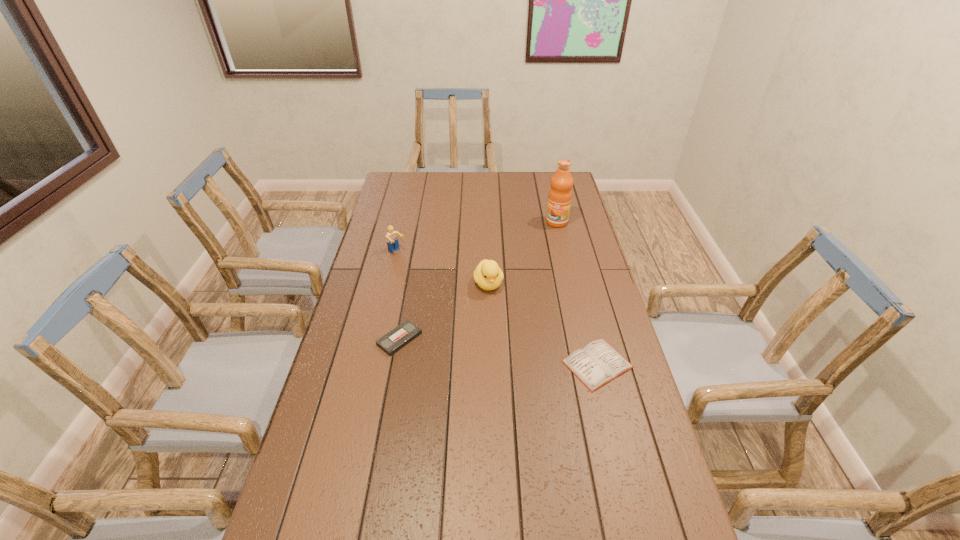
Find the location of a particular element. This screenshot has height=540, width=960. free space between the videotape and the diary is located at coordinates (498, 352).

This screenshot has width=960, height=540. What are the coordinates of `free area in between the duck and the farthest object` in the screenshot? It's located at (522, 253).

Where is `free space between the Lego and the videotape`? free space between the Lego and the videotape is located at coordinates (398, 295).

I want to click on unoccupied area between the third object from left to right and the Lego, so click(443, 268).

Find the location of a particular element. The width and height of the screenshot is (960, 540). free spot between the tallest object and the diary is located at coordinates (577, 293).

I want to click on blank region between the diary and the second farthest object, so click(x=497, y=308).

Locate an element on the screen. free space between the fruit juice and the Lego is located at coordinates (477, 237).

The height and width of the screenshot is (540, 960). Find the location of `vacant space in between the duck and the fourth nearest object`. vacant space in between the duck and the fourth nearest object is located at coordinates (443, 268).

The width and height of the screenshot is (960, 540). In order to click on object that is the second closest to the diary in this screenshot , I will do `click(397, 338)`.

You are a GUI agent. You are given a task and a screenshot of the screen. Output one action in this format:
    pyautogui.click(x=<x>, y=<y>)
    Task: Click on the closest object relative to the tallest object
    Image resolution: width=960 pixels, height=540 pixels.
    Given the screenshot: What is the action you would take?
    pyautogui.click(x=488, y=276)